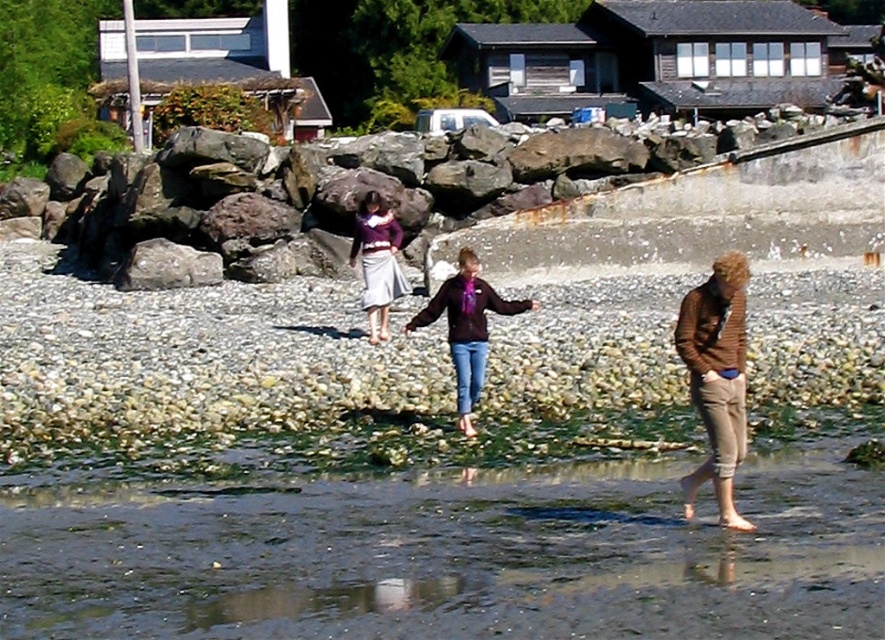
Question: Is clear water at lower center positioned at the back of matte purple sweater at center?

Choices:
 (A) yes
 (B) no

Answer: (B)

Question: Which object is farther from the camera taking this photo?

Choices:
 (A) clear water at lower center
 (B) matte purple jacket at center
 (C) matte purple sweater at center

Answer: (C)

Question: Does rusty concrete wall at upper center appear on the right side of gray rough rock at left?

Choices:
 (A) yes
 (B) no

Answer: (A)

Question: Which object is closer to the camera taking this photo?

Choices:
 (A) gray rough rock at left
 (B) brown striped sweater at lower right
 (C) matte purple jacket at center
 (D) rusty concrete wall at upper center

Answer: (B)

Question: Which of the following is the closest to the observer?

Choices:
 (A) (729, 276)
 (B) (509, 314)

Answer: (A)

Question: Is clear water at lower center below brown striped sweater at lower right?

Choices:
 (A) no
 (B) yes

Answer: (B)